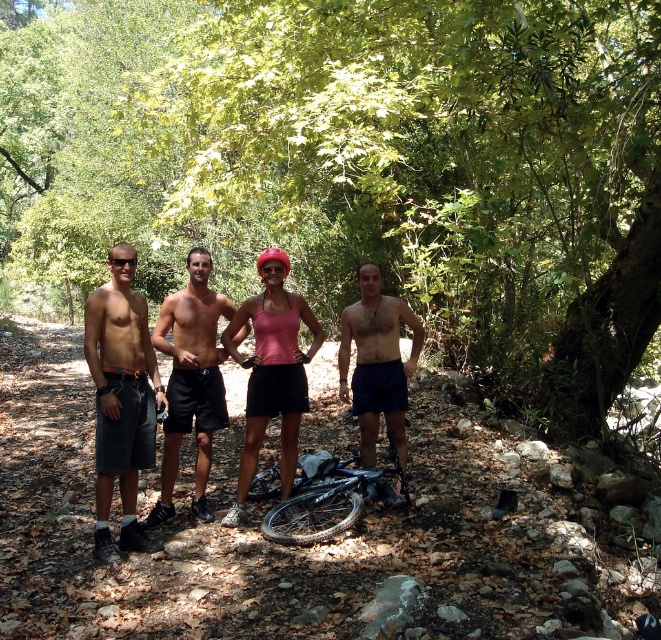
Question: Does gray cotton shorts at left have a larger size compared to pink matte tank top at center?

Choices:
 (A) no
 (B) yes

Answer: (A)

Question: Which point is closer to the camera taking this photo?

Choices:
 (A) (264, 484)
 (B) (194, 502)
 (C) (245, 360)
 (D) (381, 259)

Answer: (C)

Question: Can you confirm if pink matte tank top at center is positioned above blue matte bicycle at center?

Choices:
 (A) no
 (B) yes

Answer: (B)

Question: Which object is positioned closest to the gray cotton shorts at left?

Choices:
 (A) shiny blue shorts at center
 (B) blue matte bicycle at center

Answer: (B)

Question: Is gray cotton shorts at left positioned behind pink matte tank top at center?

Choices:
 (A) no
 (B) yes

Answer: (A)

Question: Which point is closer to the camera?

Choices:
 (A) (650, 148)
 (B) (262, 472)
 (C) (167, 355)

Answer: (A)